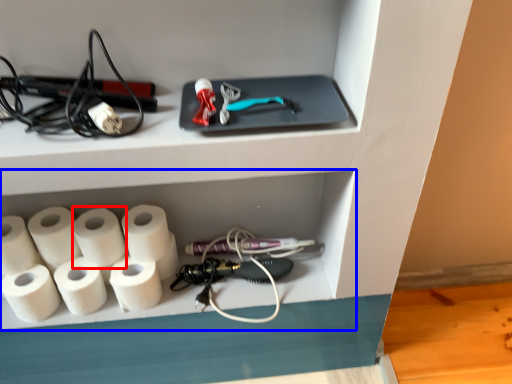
Question: Which object appears closest to the camera in this image, paper towel (highlighted by a red box) or shelf (highlighted by a blue box)?

Choices:
 (A) paper towel
 (B) shelf

Answer: (A)